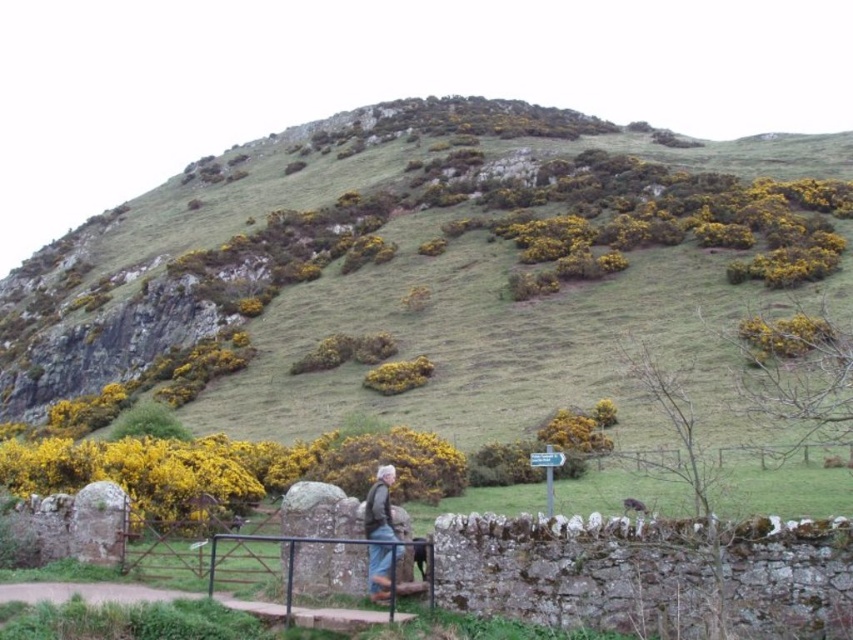
Which is behind, point (509, 236) or point (375, 568)?

The point (509, 236) is behind.

Is point (698, 221) less distant than point (379, 547)?

No, (698, 221) is further to viewer.

The image size is (853, 640). Identify the location of green grassy hillside at upper center. (387, 228).